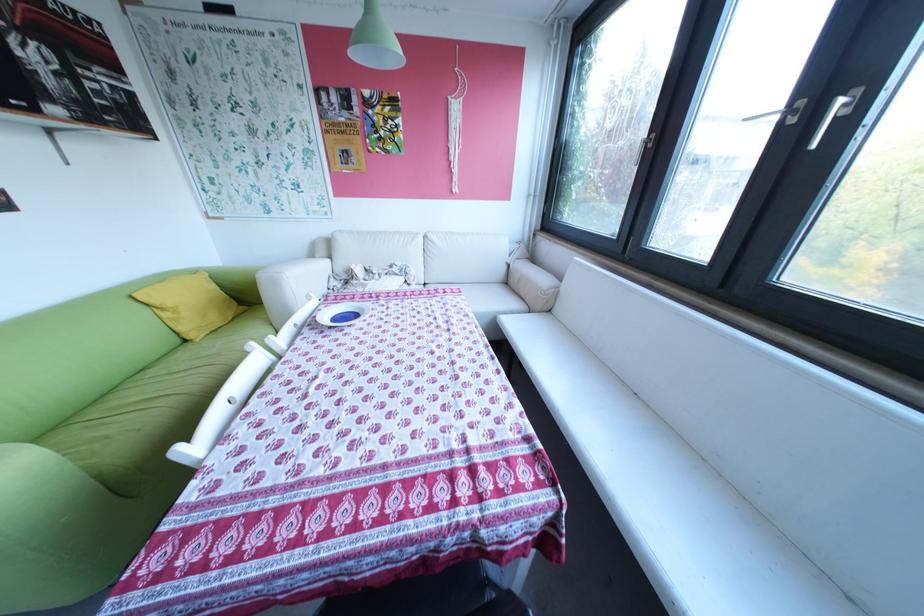
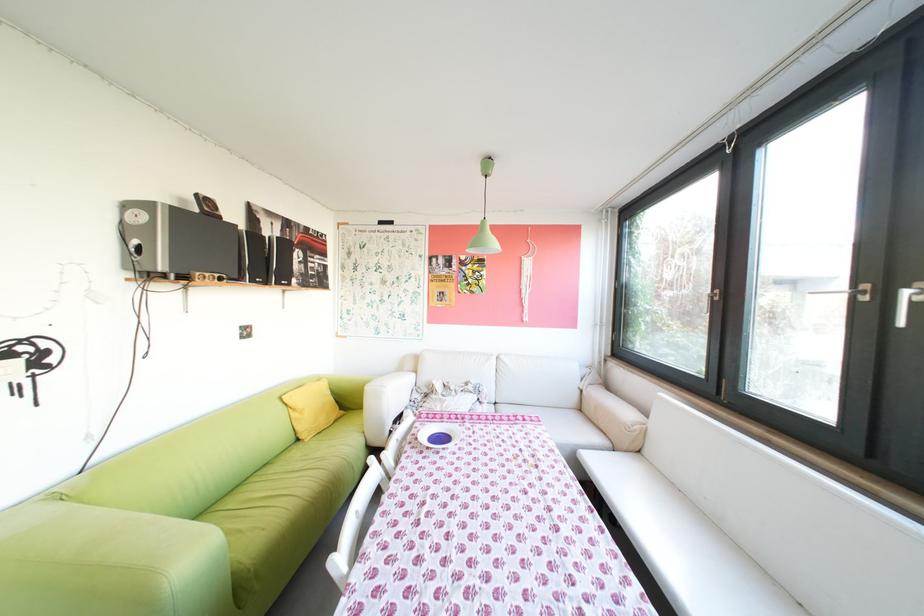
Question: How did the camera likely rotate?

Choices:
 (A) Left
 (B) Right
 (C) Up
 (D) Down

Answer: (C)